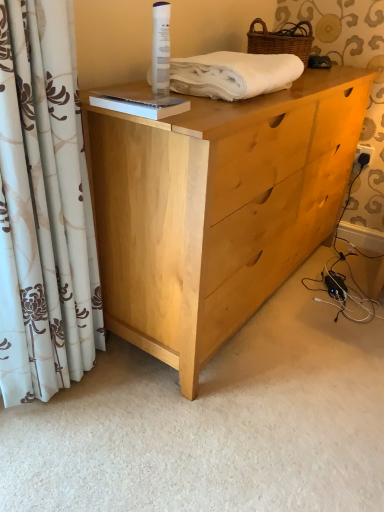
Question: Considering the relative sizes of white floral curtain at left and white cotton towel at upper center in the image provided, is white floral curtain at left taller than white cotton towel at upper center?

Choices:
 (A) no
 (B) yes

Answer: (B)

Question: Is white floral curtain at left completely or partially outside of white cotton towel at upper center?

Choices:
 (A) yes
 (B) no

Answer: (A)

Question: Considering the relative sizes of white floral curtain at left and white cotton towel at upper center in the image provided, is white floral curtain at left bigger than white cotton towel at upper center?

Choices:
 (A) yes
 (B) no

Answer: (A)

Question: Does white floral curtain at left have a lesser width compared to white cotton towel at upper center?

Choices:
 (A) yes
 (B) no

Answer: (A)

Question: Is the position of white floral curtain at left less distant than that of white cotton towel at upper center?

Choices:
 (A) yes
 (B) no

Answer: (A)

Question: Is white floral curtain at left at the left side of white cotton towel at upper center?

Choices:
 (A) no
 (B) yes

Answer: (B)

Question: From a real-world perspective, is light wood dresser at center positioned under white cotton towel at upper center based on gravity?

Choices:
 (A) yes
 (B) no

Answer: (A)

Question: Is light wood dresser at center smaller than white cotton towel at upper center?

Choices:
 (A) yes
 (B) no

Answer: (B)

Question: Can you confirm if light wood dresser at center is thinner than white cotton towel at upper center?

Choices:
 (A) yes
 (B) no

Answer: (B)

Question: Is light wood dresser at center at the right side of white cotton towel at upper center?

Choices:
 (A) yes
 (B) no

Answer: (A)

Question: Are light wood dresser at center and white cotton towel at upper center far apart?

Choices:
 (A) yes
 (B) no

Answer: (B)

Question: Does light wood dresser at center have a larger size compared to white cotton towel at upper center?

Choices:
 (A) yes
 (B) no

Answer: (A)

Question: Is white floral curtain at left taller than woven brown basket at upper right?

Choices:
 (A) yes
 (B) no

Answer: (A)